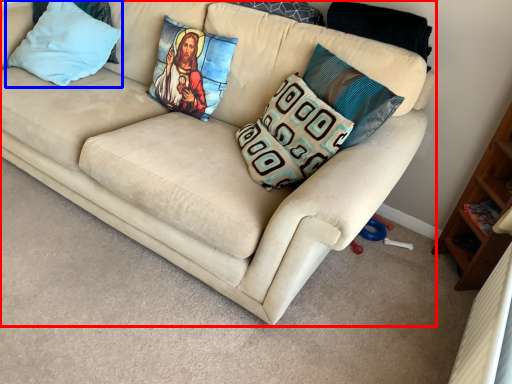
Question: Which of the following is the closest to the observer, studio couch (highlighted by a red box) or pillow (highlighted by a blue box)?

Choices:
 (A) studio couch
 (B) pillow

Answer: (A)